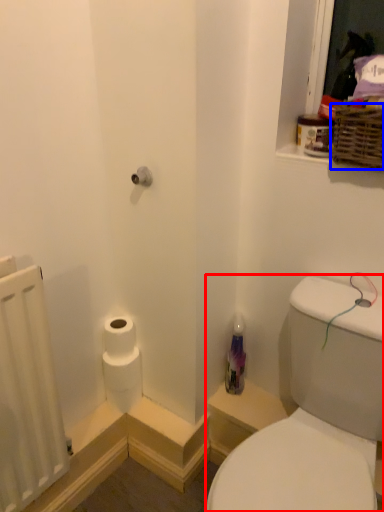
Question: Among these objects, which one is nearest to the camera, sink (highlighted by a red box) or basket (highlighted by a blue box)?

Choices:
 (A) sink
 (B) basket

Answer: (A)